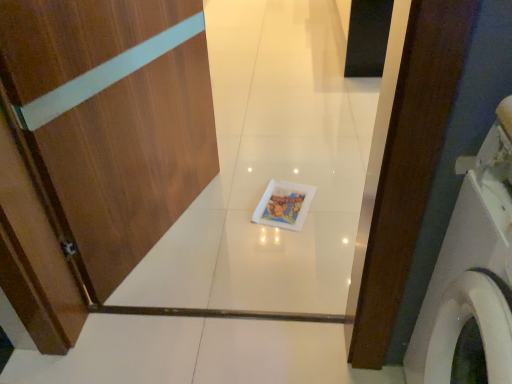
The image size is (512, 384). Find the location of `vacant area that lies to the right of wooden door at center`. vacant area that lies to the right of wooden door at center is located at coordinates (268, 216).